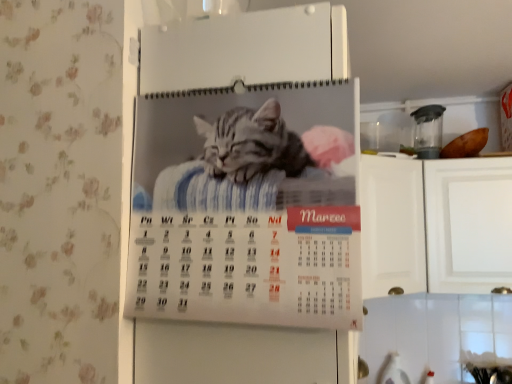
Describe the element at coordinates (428, 131) in the screenshot. I see `transparent plastic blender at upper right, the 1th appliance from the back` at that location.

At what (x,y) coordinates should I click in order to perform the action: click on transparent plastic blender at upper right, the 1th appliance from the back. Please return your answer as a coordinate pair (x, y). This screenshot has width=512, height=384. Looking at the image, I should click on (428, 131).

The height and width of the screenshot is (384, 512). Describe the element at coordinates (251, 48) in the screenshot. I see `white glossy calendar at center, which appears as the second appliance when viewed from the right` at that location.

Locate an element on the screen. white glossy calendar at center, which ranks as the first appliance in bottom-to-top order is located at coordinates (251, 48).

Locate an element on the screen. transparent plastic blender at upper right, the second appliance viewed from the left is located at coordinates (428, 131).

Considering the positions of objects transparent plastic blender at upper right, which appears as the 2th appliance when viewed from the front, and white glossy calendar at center, which ranks as the first appliance in bottom-to-top order, in the image provided, who is more to the left, transparent plastic blender at upper right, which appears as the 2th appliance when viewed from the front, or white glossy calendar at center, which ranks as the first appliance in bottom-to-top order,?

white glossy calendar at center, which ranks as the first appliance in bottom-to-top order.

Relative to white glossy calendar at center, which is the 2th appliance in back-to-front order, is transparent plastic blender at upper right, the 1th appliance from the back, in front or behind?

transparent plastic blender at upper right, the 1th appliance from the back, is behind white glossy calendar at center, which is the 2th appliance in back-to-front order.

Is point (436, 133) closer or farther from the camera than point (338, 10)?

Point (436, 133) is positioned farther from the camera compared to point (338, 10).

From the image's perspective, is transparent plastic blender at upper right, arranged as the 2th appliance when ordered from the bottom, over white glossy calendar at center, which ranks as the first appliance in bottom-to-top order?

Yes, from the image's perspective, transparent plastic blender at upper right, arranged as the 2th appliance when ordered from the bottom, is on top of white glossy calendar at center, which ranks as the first appliance in bottom-to-top order.

From a real-world perspective, is transparent plastic blender at upper right, which appears as the 2th appliance when viewed from the front, below white glossy calendar at center, which ranks as the first appliance in front-to-back order?

No, from a real-world perspective, transparent plastic blender at upper right, which appears as the 2th appliance when viewed from the front, is not under white glossy calendar at center, which ranks as the first appliance in front-to-back order.

Looking at their sizes, would you say transparent plastic blender at upper right, arranged as the 2th appliance when ordered from the bottom, is wider or thinner than white glossy calendar at center, which appears as the second appliance when viewed from the right?

transparent plastic blender at upper right, arranged as the 2th appliance when ordered from the bottom, is thinner than white glossy calendar at center, which appears as the second appliance when viewed from the right.

Considering the sizes of objects transparent plastic blender at upper right, the second appliance viewed from the left, and white glossy calendar at center, which is counted as the first appliance, starting from the left, in the image provided, who is taller, transparent plastic blender at upper right, the second appliance viewed from the left, or white glossy calendar at center, which is counted as the first appliance, starting from the left,?

white glossy calendar at center, which is counted as the first appliance, starting from the left, is taller.

Does transparent plastic blender at upper right, positioned as the first appliance in top-to-bottom order, have a larger size compared to white glossy calendar at center, which is the 2th appliance in back-to-front order?

Actually, transparent plastic blender at upper right, positioned as the first appliance in top-to-bottom order, might be smaller than white glossy calendar at center, which is the 2th appliance in back-to-front order.

Is white glossy calendar at center, which appears as the second appliance when viewed from the right, inside transparent plastic blender at upper right, arranged as the 2th appliance when ordered from the bottom?

No, white glossy calendar at center, which appears as the second appliance when viewed from the right, is not inside transparent plastic blender at upper right, arranged as the 2th appliance when ordered from the bottom.

Is there a large distance between transparent plastic blender at upper right, which ranks as the first appliance in right-to-left order, and white glossy calendar at center, which ranks as the 2th appliance in top-to-bottom order?

transparent plastic blender at upper right, which ranks as the first appliance in right-to-left order, is positioned a significant distance from white glossy calendar at center, which ranks as the 2th appliance in top-to-bottom order.

From the picture: Is transparent plastic blender at upper right, the 1th appliance from the back, facing towards white glossy calendar at center, which ranks as the first appliance in front-to-back order?

No.

In the scene shown: How different are the orientations of transparent plastic blender at upper right, arranged as the 2th appliance when ordered from the bottom, and white glossy calendar at center, which is counted as the first appliance, starting from the left, in degrees?

The facing directions of transparent plastic blender at upper right, arranged as the 2th appliance when ordered from the bottom, and white glossy calendar at center, which is counted as the first appliance, starting from the left, are 88 degrees apart.

Measure the distance from transparent plastic blender at upper right, the 1th appliance from the back, to white glossy calendar at center, which ranks as the 2th appliance in top-to-bottom order.

They are 1.54 meters apart.

Identify the location of appliance on the left of transparent plastic blender at upper right, which appears as the 2th appliance when viewed from the front. Image resolution: width=512 pixels, height=384 pixels. (251, 48).

Considering the positions of objects white glossy calendar at center, which ranks as the first appliance in front-to-back order, and transparent plastic blender at upper right, which appears as the 2th appliance when viewed from the front, in the image provided, who is more to the right, white glossy calendar at center, which ranks as the first appliance in front-to-back order, or transparent plastic blender at upper right, which appears as the 2th appliance when viewed from the front,?

From the viewer's perspective, transparent plastic blender at upper right, which appears as the 2th appliance when viewed from the front, appears more on the right side.

Is white glossy calendar at center, which ranks as the first appliance in front-to-back order, behind transparent plastic blender at upper right, which appears as the 2th appliance when viewed from the front?

No, the depth of white glossy calendar at center, which ranks as the first appliance in front-to-back order, is less than that of transparent plastic blender at upper right, which appears as the 2th appliance when viewed from the front.

Which is more distant, (341, 380) or (441, 140)?

The point (441, 140) is farther from the camera.

From the image's perspective, which one is positioned higher, white glossy calendar at center, which ranks as the 2th appliance in top-to-bottom order, or transparent plastic blender at upper right, positioned as the first appliance in top-to-bottom order?

transparent plastic blender at upper right, positioned as the first appliance in top-to-bottom order, is shown above in the image.

From a real-world perspective, relative to transparent plastic blender at upper right, arranged as the 2th appliance when ordered from the bottom, is white glossy calendar at center, which is counted as the first appliance, starting from the left, vertically above or below?

white glossy calendar at center, which is counted as the first appliance, starting from the left, is situated lower than transparent plastic blender at upper right, arranged as the 2th appliance when ordered from the bottom, in the real world.

Looking at this image, between white glossy calendar at center, which is the 2th appliance in back-to-front order, and transparent plastic blender at upper right, the 1th appliance from the back, which one has larger width?

white glossy calendar at center, which is the 2th appliance in back-to-front order, is wider.

Considering the relative sizes of white glossy calendar at center, which ranks as the first appliance in bottom-to-top order, and transparent plastic blender at upper right, the second appliance viewed from the left, in the image provided, is white glossy calendar at center, which ranks as the first appliance in bottom-to-top order, taller than transparent plastic blender at upper right, the second appliance viewed from the left,?

Yes, white glossy calendar at center, which ranks as the first appliance in bottom-to-top order, is taller than transparent plastic blender at upper right, the second appliance viewed from the left.

Who is bigger, white glossy calendar at center, which appears as the second appliance when viewed from the right, or transparent plastic blender at upper right, positioned as the first appliance in top-to-bottom order?

With larger size is white glossy calendar at center, which appears as the second appliance when viewed from the right.

Is white glossy calendar at center, which ranks as the first appliance in front-to-back order, surrounding transparent plastic blender at upper right, which ranks as the first appliance in right-to-left order?

No.

Are white glossy calendar at center, which ranks as the 2th appliance in top-to-bottom order, and transparent plastic blender at upper right, arranged as the 2th appliance when ordered from the bottom, beside each other?

There is a gap between white glossy calendar at center, which ranks as the 2th appliance in top-to-bottom order, and transparent plastic blender at upper right, arranged as the 2th appliance when ordered from the bottom.

Could you tell me if white glossy calendar at center, which ranks as the first appliance in front-to-back order, is turned towards transparent plastic blender at upper right, which appears as the 2th appliance when viewed from the front?

No.

This screenshot has height=384, width=512. In order to click on appliance that appears below the transparent plastic blender at upper right, the second appliance viewed from the left (from a real-world perspective) in this screenshot , I will do `click(251, 48)`.

Find the location of a particular element. The width and height of the screenshot is (512, 384). appliance behind the white glossy calendar at center, which is counted as the first appliance, starting from the left is located at coordinates (428, 131).

Locate an element on the screen. appliance on the left of transparent plastic blender at upper right, arranged as the 2th appliance when ordered from the bottom is located at coordinates (251, 48).